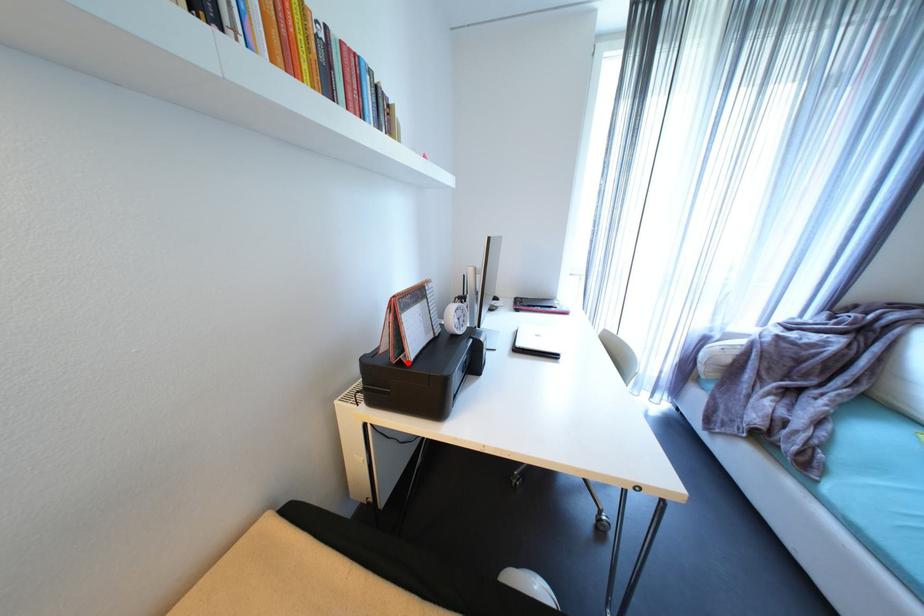
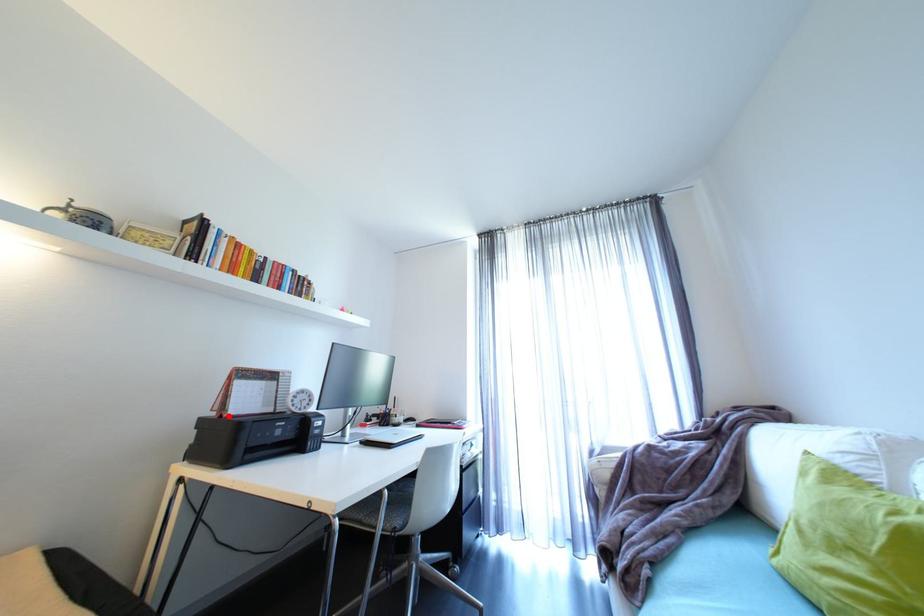
I am providing you with two images of the same scene from different viewpoints. A red point is marked on the first image and another point is marked on the second image. Are the points marked in image1 and image2 representing the same 3D position?

Yes